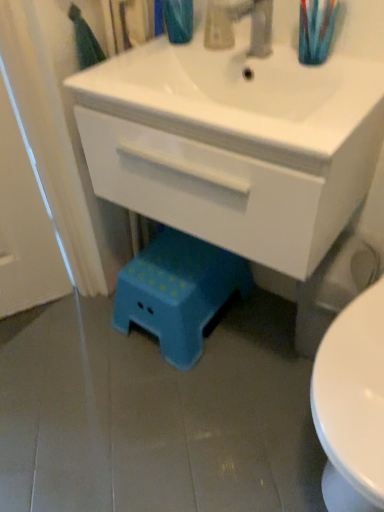
Question: Considering the positions of point (271, 203) and point (120, 273), is point (271, 203) closer or farther from the camera than point (120, 273)?

Choices:
 (A) closer
 (B) farther

Answer: (A)

Question: Based on their sizes in the image, would you say white glossy cabinet at center is bigger or smaller than blue plastic step stool at lower center?

Choices:
 (A) small
 (B) big

Answer: (B)

Question: Estimate the real-world distances between objects in this image. Which object is closer to the translucent plastic toothbrush at upper right?

Choices:
 (A) blue plastic step stool at lower center
 (B) white glossy cabinet at center
 (C) teal plastic stool at lower center
 (D) metallic silver faucet at upper center
 (E) translucent plastic soap dispenser at upper center

Answer: (D)

Question: Which is farther from the metallic silver faucet at upper center?

Choices:
 (A) translucent plastic toothbrush at upper right
 (B) white glossy cabinet at center
 (C) blue plastic step stool at lower center
 (D) translucent plastic soap dispenser at upper center
 (E) teal plastic stool at lower center

Answer: (C)